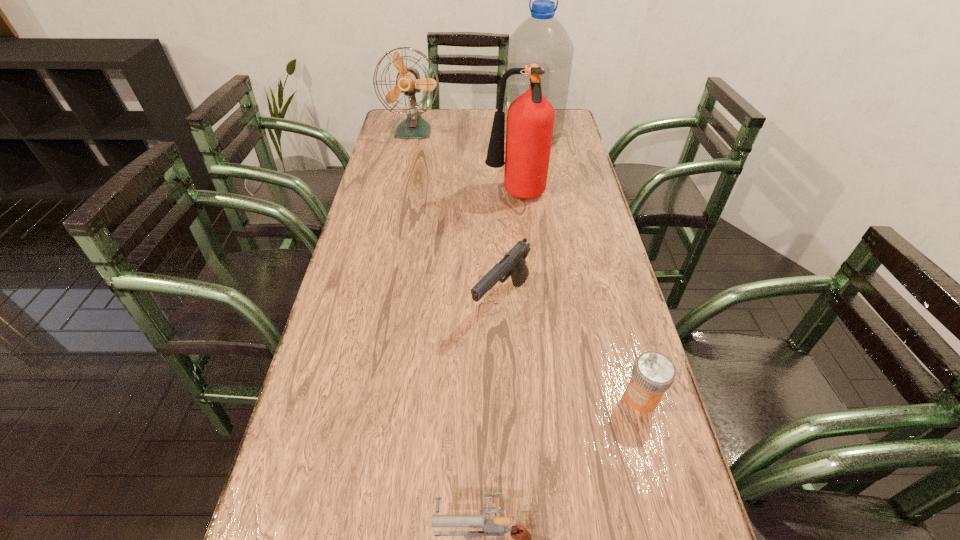
You are a GUI agent. You are given a task and a screenshot of the screen. Output one action in this format:
    pyautogui.click(x=<x>, y=<y>)
    Task: Click on the unoccupied area between the taller gun and the water jug
    
    Given the screenshot: What is the action you would take?
    pyautogui.click(x=516, y=220)

Locate an element on the screen. This screenshot has width=960, height=540. free spot between the water jug and the leftmost object is located at coordinates (472, 134).

Image resolution: width=960 pixels, height=540 pixels. I want to click on free space between the taller gun and the medicine, so (x=571, y=349).

Identify the location of vacant area that lies between the taller gun and the fire extinguisher. The height and width of the screenshot is (540, 960). (509, 249).

Locate an element on the screen. This screenshot has height=540, width=960. the second closest object to the shorter gun is located at coordinates (514, 262).

The width and height of the screenshot is (960, 540). I want to click on object that ranks as the fifth closest to the second tallest object, so click(x=492, y=527).

Image resolution: width=960 pixels, height=540 pixels. I want to click on free location that satisfies the following two spatial constraints: 1. on the front-facing side of the fan for air flow; 2. on the left side of the water jug, so click(412, 139).